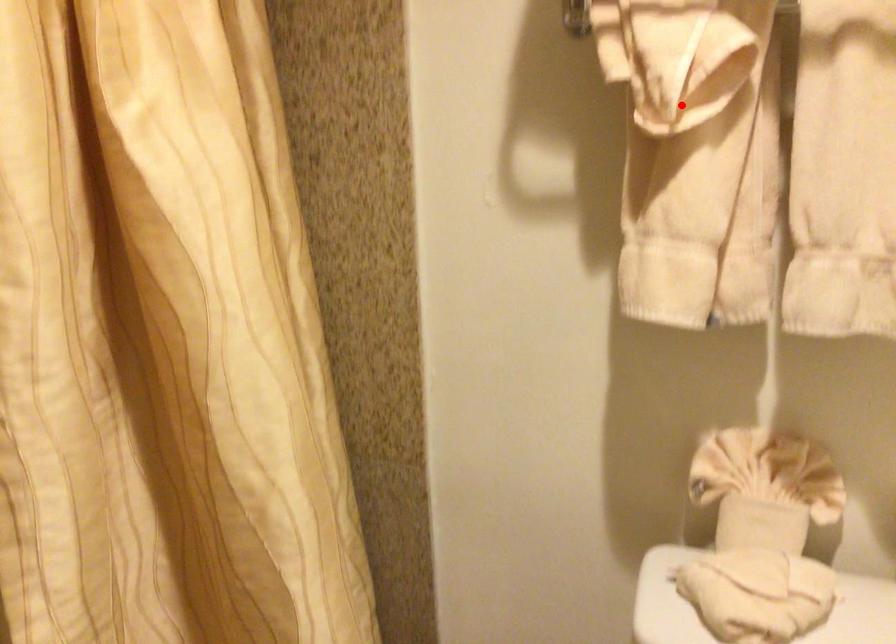
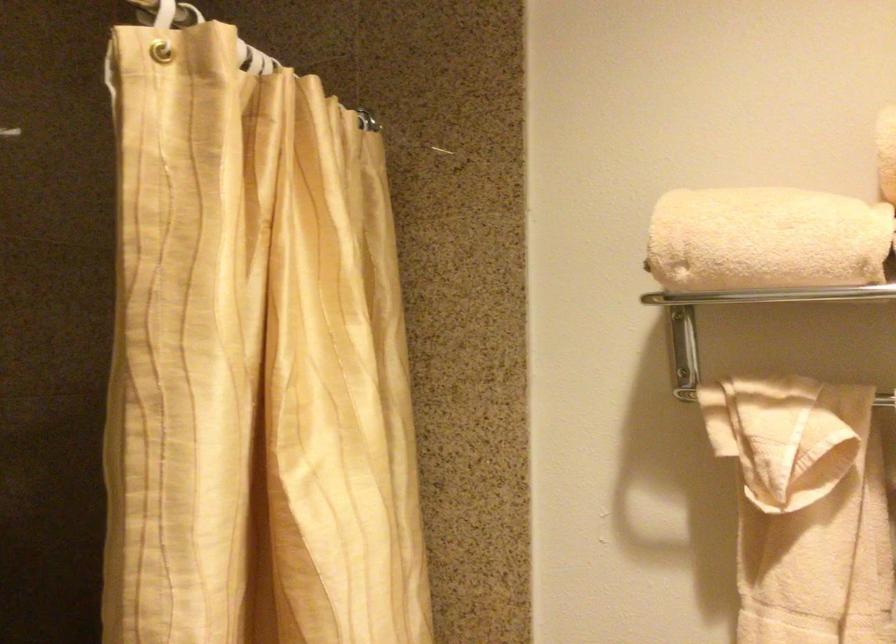
Where in the second image is the point corresponding to the highlighted location from the first image?

(793, 486)